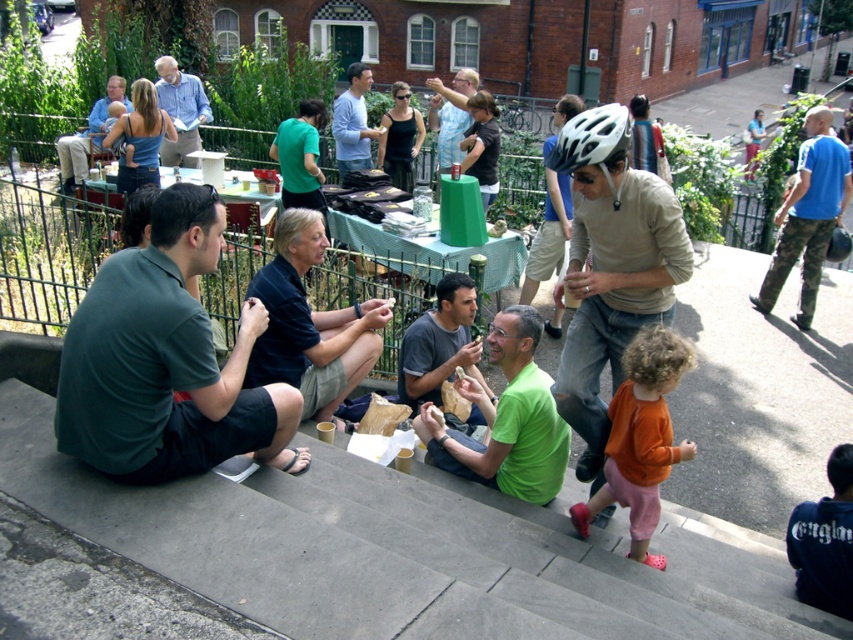
Is green matte shirt at center above light blue shirt at center?

No.

Looking at this image, measure the distance from green matte shirt at center to light blue shirt at center.

They are 6.61 meters apart.

Is point (506, 467) more distant than point (335, 148)?

No, it is in front of (335, 148).

The width and height of the screenshot is (853, 640). Identify the location of green matte shirt at center. (506, 419).

Does matte beige helmet at center have a greater width compared to matte blue shirt at center?

In fact, matte beige helmet at center might be narrower than matte blue shirt at center.

Who is lower down, matte beige helmet at center or matte blue shirt at center?

matte beige helmet at center is lower down.

The image size is (853, 640). In order to click on matte beige helmet at center in this screenshot , I will do point(610,266).

Between dark gray t-shirt at center and matte blue shirt at upper left, which one appears on the left side from the viewer's perspective?

matte blue shirt at upper left

Is point (424, 355) in front of point (61, 136)?

Yes, it is in front of point (61, 136).

Identify the location of dark gray t-shirt at center. (440, 342).

Locate an element on the screen. dark gray t-shirt at center is located at coordinates (440, 342).